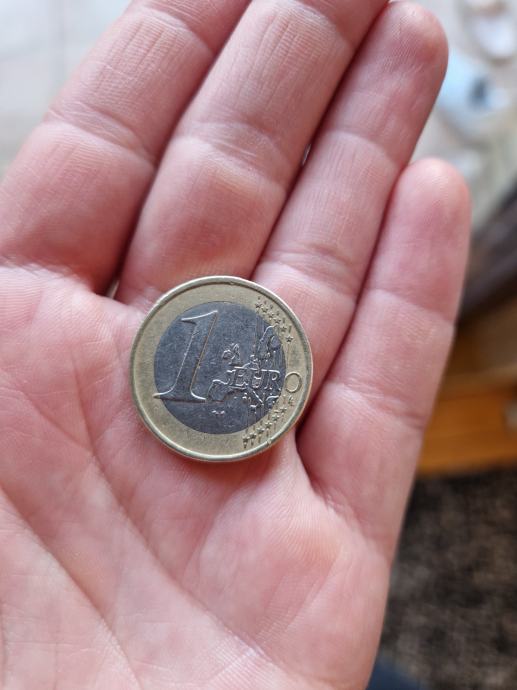
Where is `blurry carpet`? This screenshot has height=690, width=517. blurry carpet is located at coordinates (460, 653).